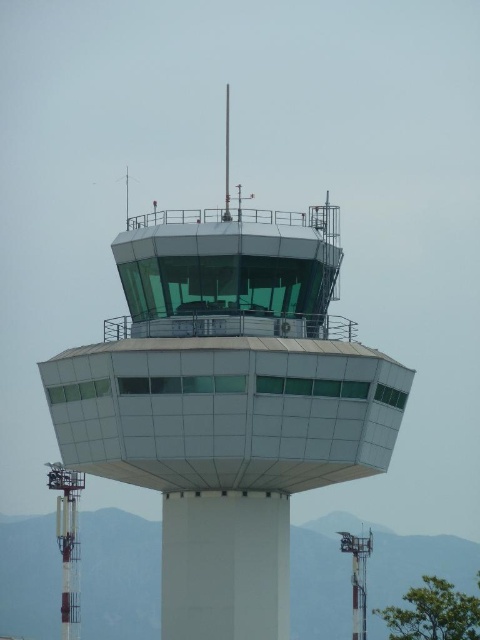
In the scene shown: Is the position of white glass tower at center more distant than that of metallic antenna at lower right?

That is False.

Does point (87, 396) lie behind point (360, 572)?

No, (87, 396) is in front of (360, 572).

Does point (310, 305) come behind point (359, 605)?

No, it is not.

You are a GUI agent. You are given a task and a screenshot of the screen. Output one action in this format:
    pyautogui.click(x=<x>, y=<y>)
    Task: Click on the white glass tower at center
    The height and width of the screenshot is (640, 480).
    Given the screenshot: What is the action you would take?
    pyautogui.click(x=227, y=401)

Which is below, white glass tower at center or white glossy control tower at left?

white glossy control tower at left is below.

Is white glass tower at center smaller than white glossy control tower at left?

Incorrect, white glass tower at center is not smaller in size than white glossy control tower at left.

Between point (212, 598) and point (76, 531), which one is positioned in front?

Positioned in front is point (212, 598).

Locate an element on the screen. white glass tower at center is located at coordinates (227, 401).

Is the position of white glossy control tower at left more distant than that of metallic antenna at lower right?

That is False.

Who is lower down, white glossy control tower at left or metallic antenna at lower right?

metallic antenna at lower right

At what (x,y) coordinates should I click in order to perform the action: click on white glossy control tower at left. Please return your answer as a coordinate pair (x, y). The width and height of the screenshot is (480, 640). Looking at the image, I should click on (68, 541).